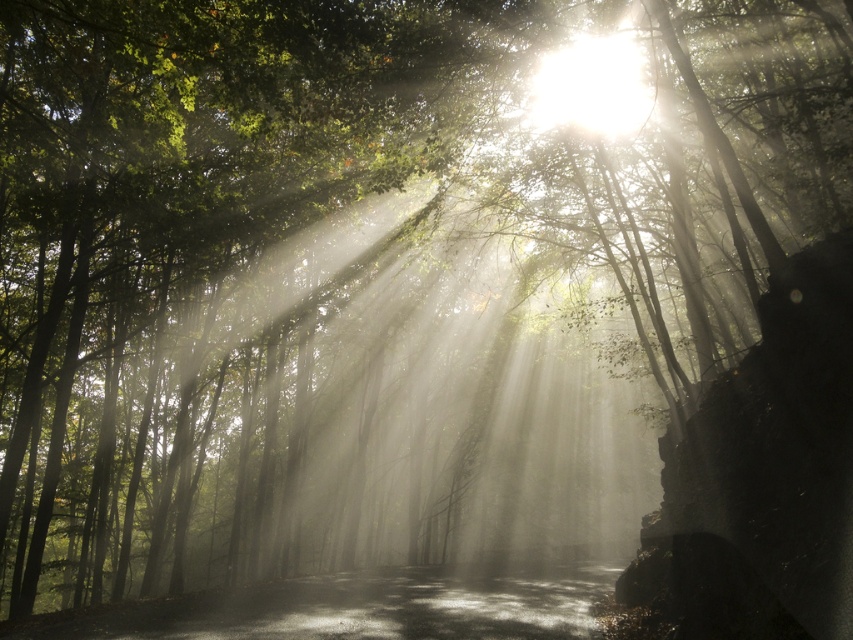
Question: Is shiny asphalt road at center further to the viewer compared to bright white light at upper center?

Choices:
 (A) no
 (B) yes

Answer: (A)

Question: Which point appears farthest from the camera in this image?

Choices:
 (A) 531,596
 (B) 601,104

Answer: (A)

Question: Is the position of shiny asphalt road at center more distant than that of bright white light at upper center?

Choices:
 (A) yes
 (B) no

Answer: (B)

Question: Is shiny asphalt road at center above bright white light at upper center?

Choices:
 (A) yes
 (B) no

Answer: (B)